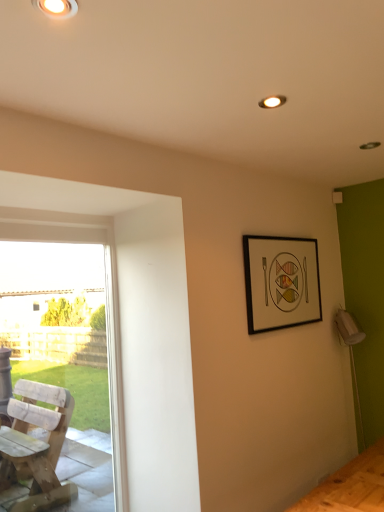
Question: Can you confirm if matte white ceiling light at upper left is positioned to the right of wooden chair at left?

Choices:
 (A) no
 (B) yes

Answer: (B)

Question: Is matte white ceiling light at upper left beside wooden chair at left?

Choices:
 (A) no
 (B) yes

Answer: (A)

Question: Does matte white ceiling light at upper left have a lesser height compared to wooden chair at left?

Choices:
 (A) no
 (B) yes

Answer: (B)

Question: Is matte white ceiling light at upper left not within wooden chair at left?

Choices:
 (A) yes
 (B) no

Answer: (A)

Question: Is matte white ceiling light at upper left positioned far away from wooden chair at left?

Choices:
 (A) no
 (B) yes

Answer: (B)

Question: Would you say black matte picture frame at upper right is inside or outside matte white ceiling light at upper left?

Choices:
 (A) outside
 (B) inside

Answer: (A)

Question: In the image, is black matte picture frame at upper right on the left side or the right side of matte white ceiling light at upper left?

Choices:
 (A) left
 (B) right

Answer: (B)

Question: Considering the positions of black matte picture frame at upper right and matte white ceiling light at upper left in the image, is black matte picture frame at upper right taller or shorter than matte white ceiling light at upper left?

Choices:
 (A) tall
 (B) short

Answer: (A)

Question: Considering the positions of point (284, 303) and point (61, 13), is point (284, 303) closer or farther from the camera than point (61, 13)?

Choices:
 (A) closer
 (B) farther

Answer: (B)

Question: From a real-world perspective, is wooden chair at left physically located above or below matte white ceiling light at upper left?

Choices:
 (A) above
 (B) below

Answer: (B)

Question: Based on their positions, is wooden chair at left located to the left or right of matte white ceiling light at upper left?

Choices:
 (A) left
 (B) right

Answer: (A)

Question: Is point (124, 468) closer or farther from the camera than point (56, 2)?

Choices:
 (A) closer
 (B) farther

Answer: (B)

Question: Which is correct: wooden chair at left is inside matte white ceiling light at upper left, or outside of it?

Choices:
 (A) outside
 (B) inside

Answer: (A)

Question: In terms of size, does black matte picture frame at upper right appear bigger or smaller than wooden chair at left?

Choices:
 (A) small
 (B) big

Answer: (A)

Question: From the image's perspective, is black matte picture frame at upper right above or below wooden chair at left?

Choices:
 (A) above
 (B) below

Answer: (A)